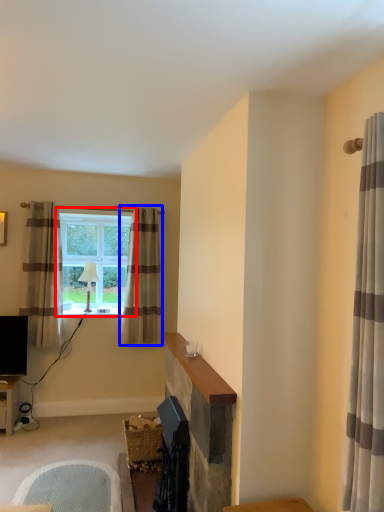
Question: Among these objects, which one is farthest to the camera, window (highlighted by a red box) or curtain (highlighted by a blue box)?

Choices:
 (A) window
 (B) curtain

Answer: (A)